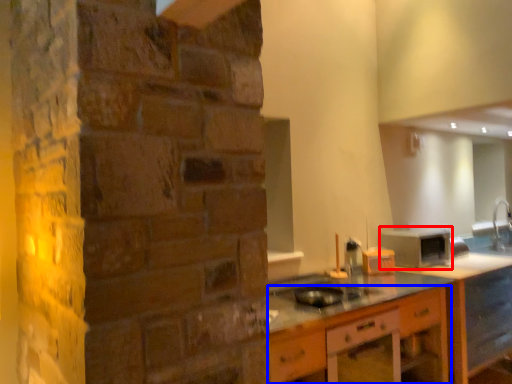
Question: Which object is closer to the camera taking this photo, appliance (highlighted by a red box) or cabinetry (highlighted by a blue box)?

Choices:
 (A) appliance
 (B) cabinetry

Answer: (B)